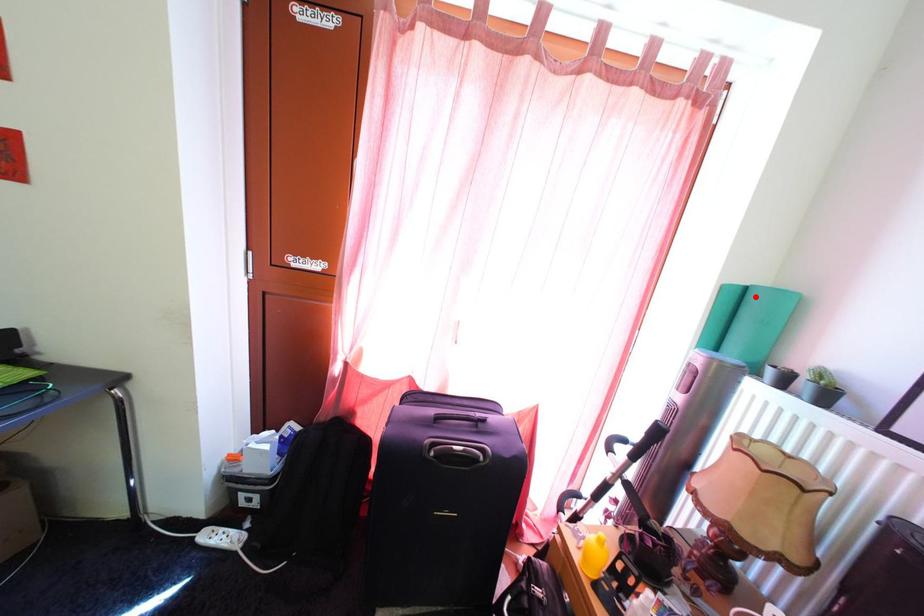
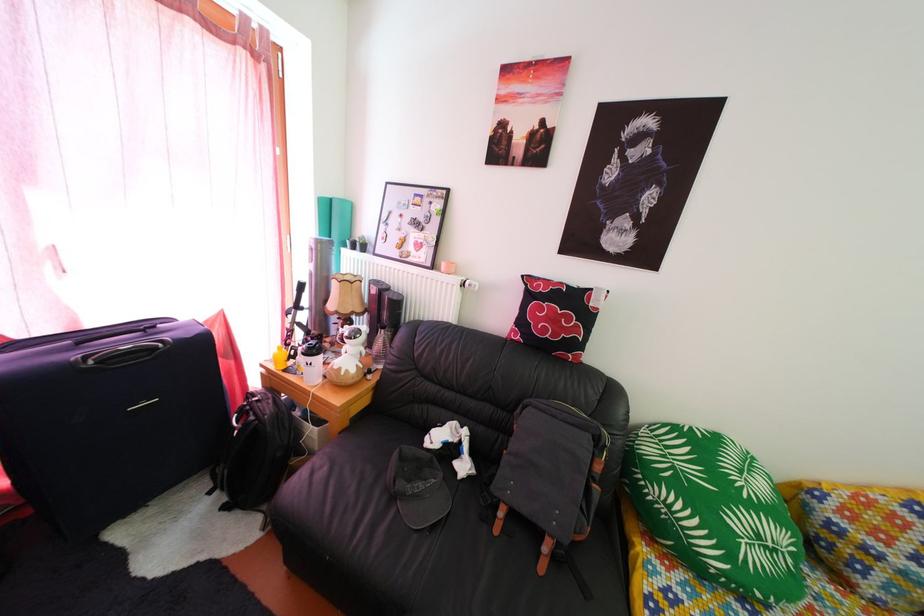
Question: A red point is marked in image1. In image2, is the corresponding 3D point closer to the camera or farther? Reply with the corresponding letter.

Choices:
 (A) The corresponding 3D point is closer.
 (B) The corresponding 3D point is farther.

Answer: (A)